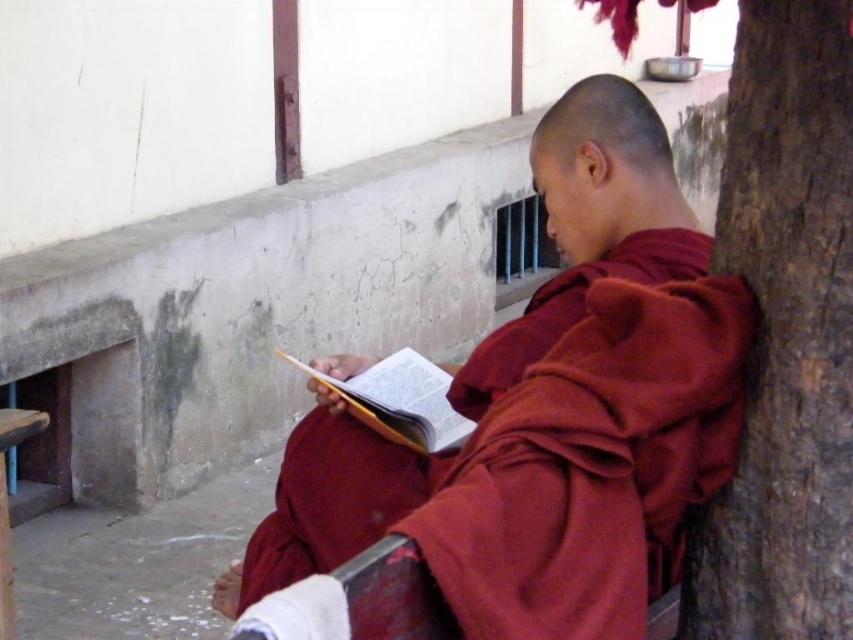
You are a visitor at the monastery and notice the brown rough bark at right and the yellow paper book at center. Which object is positioned farther to the east?

The brown rough bark at right is positioned to the right of the yellow paper book at center, so it is farther to the east.

You are a visitor at the monastery and want to place a small offering on the object closest to the center. Which object should you choose between the brown rough bark at right and the maroon cloth at center?

The maroon cloth at center is closer to the center, so you should place the offering there.

You are a visitor at the monastery and want to know the position of the maroon cloth at center and the yellow paper book at center. Which object is located to the right of the other?

The maroon cloth at center is positioned on the right side of yellow paper book at center, so the maroon cloth at center is to the right of the yellow paper book at center.